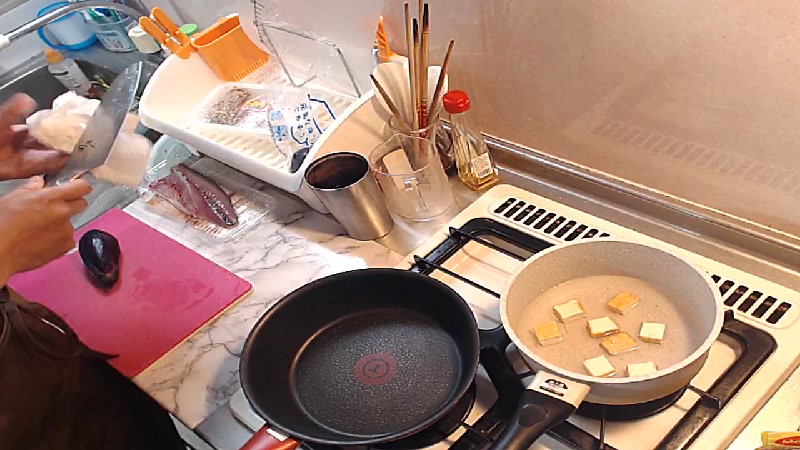
Where is `stove`? The image size is (800, 450). stove is located at coordinates (480, 254).